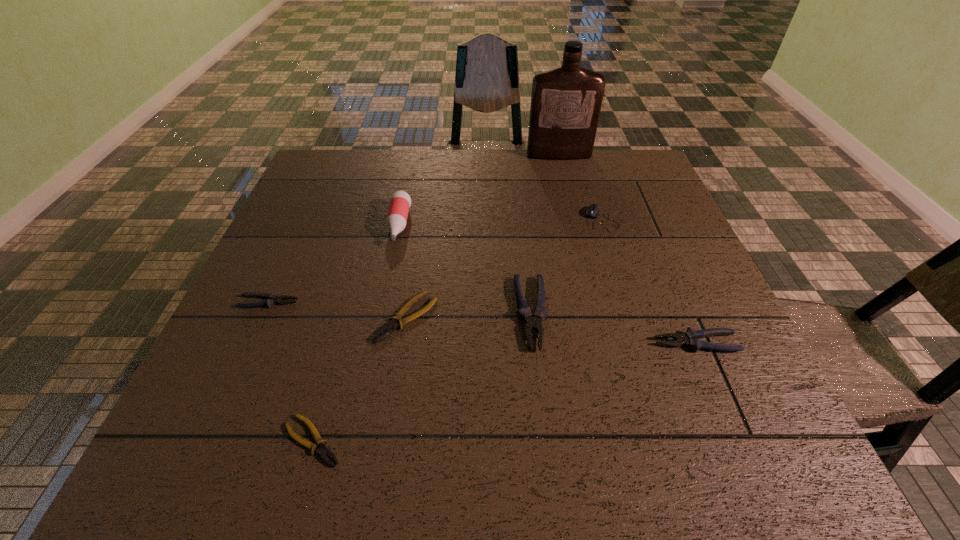
The width and height of the screenshot is (960, 540). Find the location of `the leftmost gray pliers`. the leftmost gray pliers is located at coordinates (271, 299).

You are a GUI agent. You are given a task and a screenshot of the screen. Output one action in this format:
    pyautogui.click(x=<x>, y=<y>)
    Task: Click on the bigger yellow pliers
    This screenshot has width=960, height=540.
    Given the screenshot: What is the action you would take?
    point(387,329)

Locate an element on the screen. Image resolution: width=960 pixels, height=540 pixels. the second shortest object is located at coordinates (387, 329).

Locate an element on the screen. This screenshot has height=540, width=960. the shortest pliers is located at coordinates (322, 451).

You are a GUI agent. You are given a task and a screenshot of the screen. Output one action in this format:
    pyautogui.click(x=<x>, y=<y>)
    Task: Click on the nearest pliers
    The image size is (960, 540).
    Given the screenshot: What is the action you would take?
    click(x=322, y=451)

Image resolution: width=960 pixels, height=540 pixels. What are the coordinates of `vacant space located 0.070m on the label side of the farthest object` in the screenshot? It's located at (564, 173).

The width and height of the screenshot is (960, 540). In order to click on free space located 0.340m with the cap open on the bottle in this screenshot , I will do `click(370, 364)`.

Where is `vacant space located at the gripping part of the fifth object from left to right`? The height and width of the screenshot is (540, 960). vacant space located at the gripping part of the fifth object from left to right is located at coordinates (539, 384).

Locate an element on the screen. vacant space located 0.240m on the front of the computer mouse is located at coordinates (628, 302).

At what (x,y) coordinates should I click in order to perform the action: click on vacant space situated 0.150m at the gripping part of the rightmost gray pliers. Please return your answer as a coordinate pair (x, y). Looking at the image, I should click on (580, 343).